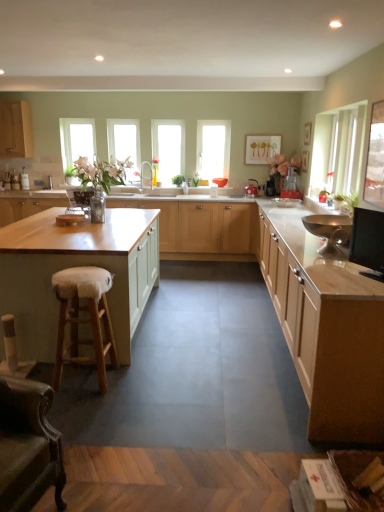
Question: Considering the relative sizes of green leafy plant at center, which is counted as the first plant, starting from the back, and light wood cabinet at right, the 5th cabinetry viewed from the top, in the image provided, is green leafy plant at center, which is counted as the first plant, starting from the back, thinner than light wood cabinet at right, the 5th cabinetry viewed from the top,?

Choices:
 (A) yes
 (B) no

Answer: (A)

Question: From a real-world perspective, is green leafy plant at center, which is counted as the first plant, starting from the left, over light wood cabinet at right, the 5th cabinetry viewed from the top?

Choices:
 (A) no
 (B) yes

Answer: (B)

Question: From the image's perspective, is green leafy plant at center, arranged as the 2th plant when ordered from the bottom, over light wood cabinet at right, which is the 1th cabinetry from bottom to top?

Choices:
 (A) yes
 (B) no

Answer: (A)

Question: Are green leafy plant at center, which is counted as the first plant, starting from the back, and light wood cabinet at right, the 5th cabinetry viewed from the top, far apart?

Choices:
 (A) no
 (B) yes

Answer: (B)

Question: Can you confirm if green leafy plant at center, which is counted as the first plant, starting from the back, is taller than light wood cabinet at right, the 5th cabinetry viewed from the top?

Choices:
 (A) no
 (B) yes

Answer: (A)

Question: Considering the relative sizes of green leafy plant at center, which is the 2th plant in right-to-left order, and light wood cabinet at right, the 5th cabinetry viewed from the top, in the image provided, is green leafy plant at center, which is the 2th plant in right-to-left order, smaller than light wood cabinet at right, the 5th cabinetry viewed from the top,?

Choices:
 (A) yes
 (B) no

Answer: (A)

Question: Does clear glass window at left, which appears as the 4th window when viewed from the right, come in front of metallic gold bowl at right, the 3th appliance viewed from the back?

Choices:
 (A) yes
 (B) no

Answer: (B)

Question: Can you confirm if clear glass window at left, which appears as the 4th window when viewed from the right, is bigger than metallic gold bowl at right, the first appliance when ordered from front to back?

Choices:
 (A) no
 (B) yes

Answer: (B)

Question: Considering the relative positions of clear glass window at left, placed as the 1th window when sorted from left to right, and metallic gold bowl at right, the third appliance viewed from the top, in the image provided, is clear glass window at left, placed as the 1th window when sorted from left to right, to the right of metallic gold bowl at right, the third appliance viewed from the top, from the viewer's perspective?

Choices:
 (A) yes
 (B) no

Answer: (B)

Question: From a real-world perspective, is clear glass window at left, which appears as the 4th window when viewed from the right, positioned under metallic gold bowl at right, the first appliance when ordered from front to back, based on gravity?

Choices:
 (A) no
 (B) yes

Answer: (A)

Question: Is clear glass window at left, placed as the 1th window when sorted from left to right, shorter than metallic gold bowl at right, the first appliance when ordered from front to back?

Choices:
 (A) yes
 (B) no

Answer: (B)

Question: Does metallic red kettle at center, positioned as the 2th appliance in bottom-to-top order, come in front of wooden island at center, the second cabinetry viewed from the top?

Choices:
 (A) no
 (B) yes

Answer: (A)